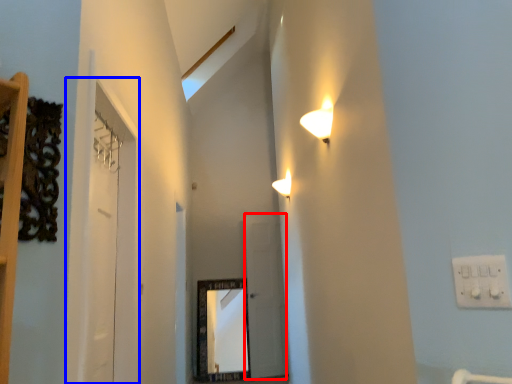
Question: Among these objects, which one is farthest to the camera, glass door (highlighted by a red box) or glass door (highlighted by a blue box)?

Choices:
 (A) glass door
 (B) glass door

Answer: (A)